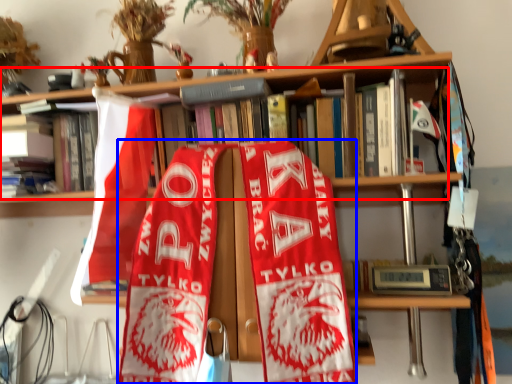
Question: Which point is further to the camera, book (highlighted by a red box) or beach towel (highlighted by a blue box)?

Choices:
 (A) book
 (B) beach towel

Answer: (A)